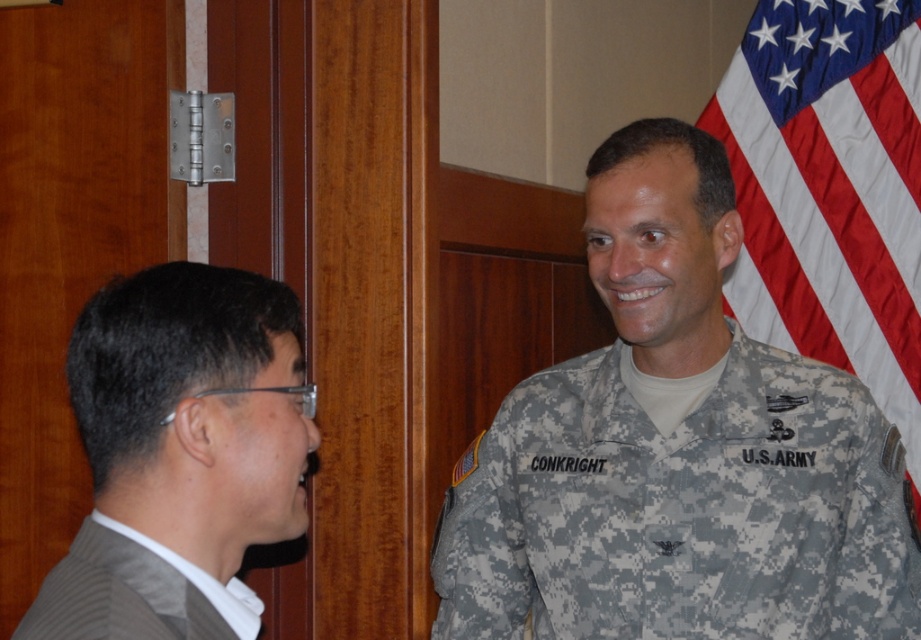
Which of these two, camouflage uniform at right or american flag at right, stands taller?

With more height is american flag at right.

Can you confirm if camouflage uniform at right is positioned to the right of american flag at right?

No, camouflage uniform at right is not to the right of american flag at right.

Locate an element on the screen. camouflage uniform at right is located at coordinates (677, 452).

Locate an element on the screen. The image size is (921, 640). camouflage uniform at right is located at coordinates (677, 452).

Which is in front, point (850, 17) or point (15, 636)?

Point (15, 636) is more forward.

Between american flag at right and gray pleated suit at left, which one has more height?

american flag at right

Is point (736, 156) positioned behind point (133, 625)?

Yes, point (736, 156) is farther from viewer.

This screenshot has width=921, height=640. Identify the location of american flag at right. (830, 189).

Who is positioned more to the right, gray suit at left or american flag at right?

american flag at right

Who is positioned more to the left, gray suit at left or american flag at right?

gray suit at left

Which is in front, point (85, 378) or point (788, 232)?

Point (85, 378)

Locate an element on the screen. This screenshot has height=640, width=921. gray suit at left is located at coordinates (194, 410).